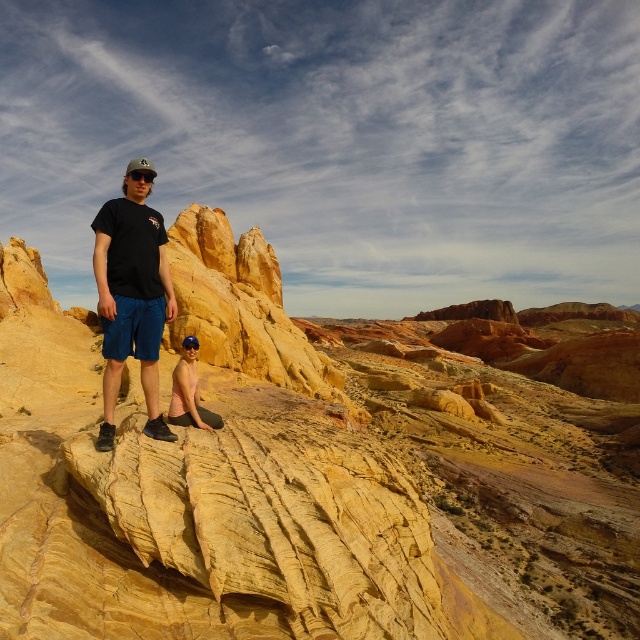
You are a photographer planning to take a photo of the yellow sandstone rock at center and the pink matte skin at lower center. Which object should you focus on first if you want to capture both in sharp focus?

The yellow sandstone rock at center is much taller than the pink matte skin at lower center, so you should focus on the yellow sandstone rock at center first to ensure both are in sharp focus.